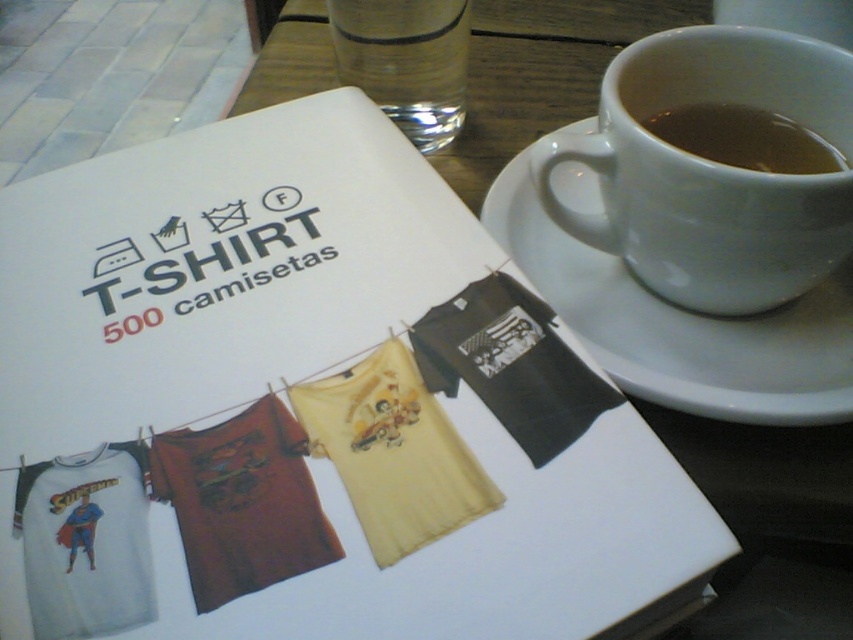
Can you confirm if white ceramic mug at upper right is taller than clear glass water at upper center?

Indeed, white ceramic mug at upper right has a greater height compared to clear glass water at upper center.

Is point (672, 148) positioned after point (461, 51)?

That is False.

Is point (811, 198) in front of point (425, 42)?

Yes, point (811, 198) is closer to viewer.

Locate an element on the screen. The image size is (853, 640). white ceramic mug at upper right is located at coordinates (712, 170).

Is the position of white ceramic mug at upper right less distant than that of brown liquid at upper right?

Yes.

Measure the distance between white ceramic mug at upper right and brown liquid at upper right.

1.39 inches

At what (x,y) coordinates should I click in order to perform the action: click on white ceramic mug at upper right. Please return your answer as a coordinate pair (x, y). The height and width of the screenshot is (640, 853). Looking at the image, I should click on (712, 170).

Looking at this image, between clear glass water at upper center and brown liquid at upper right, which one is positioned lower?

brown liquid at upper right is below.

Who is more distant from viewer, (421, 122) or (720, 125)?

Point (421, 122)

Locate an element on the screen. The image size is (853, 640). clear glass water at upper center is located at coordinates (405, 61).

Identify the location of clear glass water at upper center. Image resolution: width=853 pixels, height=640 pixels. (405, 61).